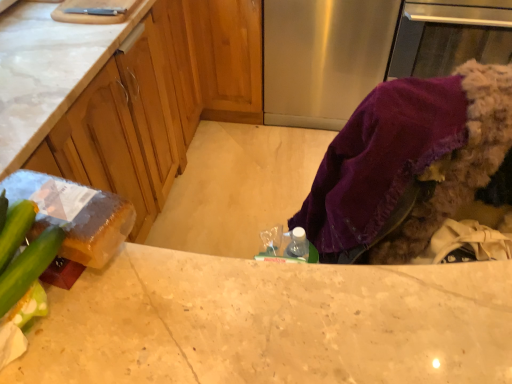
Question: Is matte wood cabinets at center a part of purple fabric at lower right?

Choices:
 (A) yes
 (B) no

Answer: (B)

Question: Can you confirm if purple fabric at lower right is positioned to the right of matte wood cabinets at center?

Choices:
 (A) yes
 (B) no

Answer: (A)

Question: Is purple fabric at lower right wider than matte wood cabinets at center?

Choices:
 (A) yes
 (B) no

Answer: (B)

Question: From the image's perspective, does purple fabric at lower right appear higher than matte wood cabinets at center?

Choices:
 (A) no
 (B) yes

Answer: (A)

Question: Considering the relative sizes of purple fabric at lower right and matte wood cabinets at center in the image provided, is purple fabric at lower right bigger than matte wood cabinets at center?

Choices:
 (A) yes
 (B) no

Answer: (B)

Question: Is purple fabric at lower right located outside matte wood cabinets at center?

Choices:
 (A) yes
 (B) no

Answer: (A)

Question: Is stainless steel refrigerator at center located outside purple fabric at lower right?

Choices:
 (A) no
 (B) yes

Answer: (B)

Question: From a real-world perspective, is stainless steel refrigerator at center on top of purple fabric at lower right?

Choices:
 (A) no
 (B) yes

Answer: (A)

Question: Is stainless steel refrigerator at center wider than purple fabric at lower right?

Choices:
 (A) yes
 (B) no

Answer: (A)

Question: Is stainless steel refrigerator at center smaller than purple fabric at lower right?

Choices:
 (A) no
 (B) yes

Answer: (A)

Question: Is the position of stainless steel refrigerator at center less distant than that of purple fabric at lower right?

Choices:
 (A) yes
 (B) no

Answer: (B)

Question: Can you confirm if stainless steel refrigerator at center is taller than purple fabric at lower right?

Choices:
 (A) yes
 (B) no

Answer: (A)

Question: Does green matte cucumber at lower left have a lesser height compared to marble countertop at center?

Choices:
 (A) yes
 (B) no

Answer: (A)